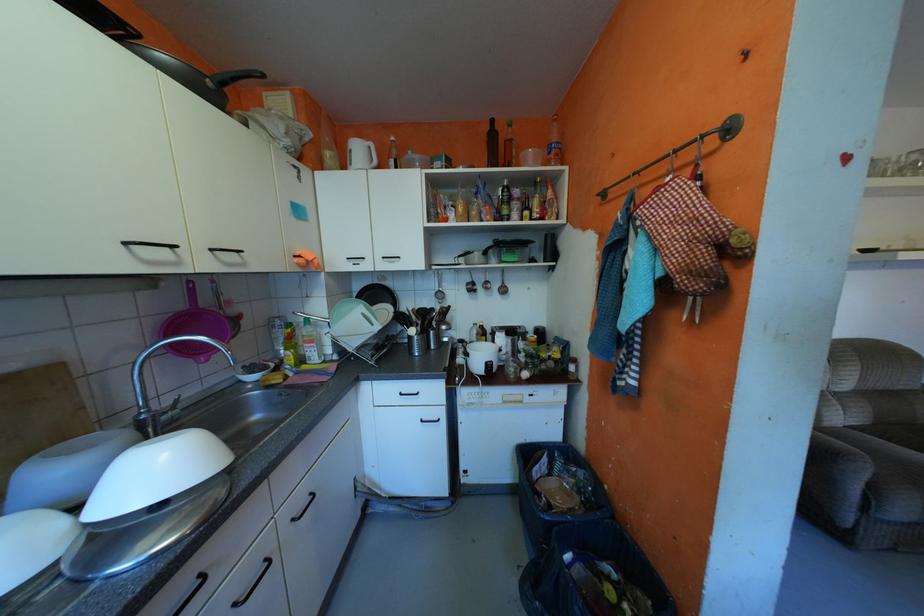
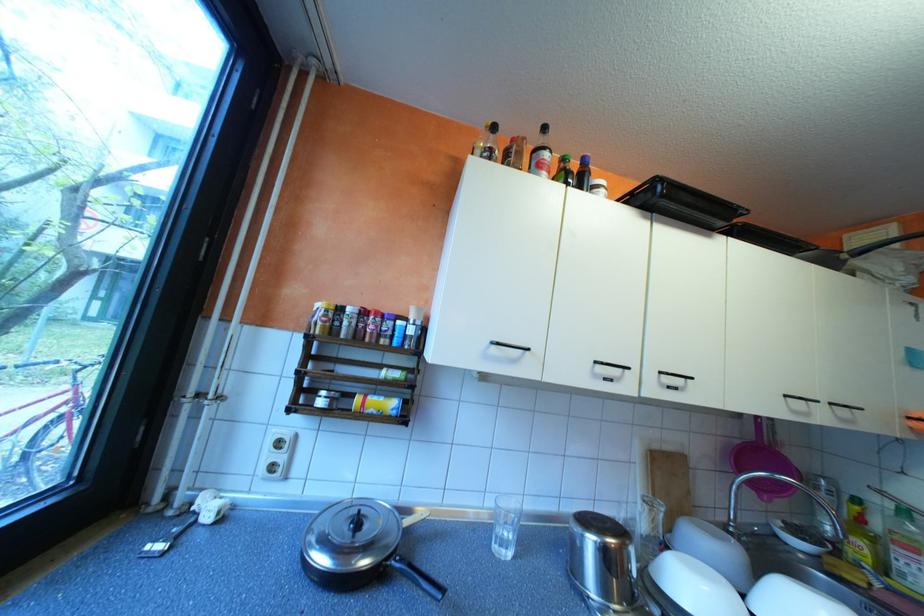
In the second image, find the point that corresponds to [300,352] in the first image.

(871, 541)